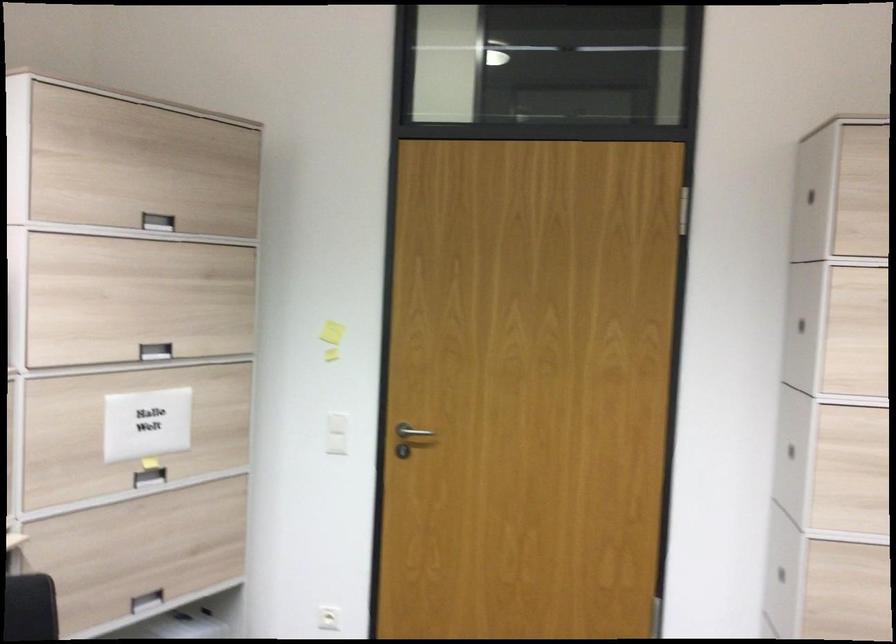
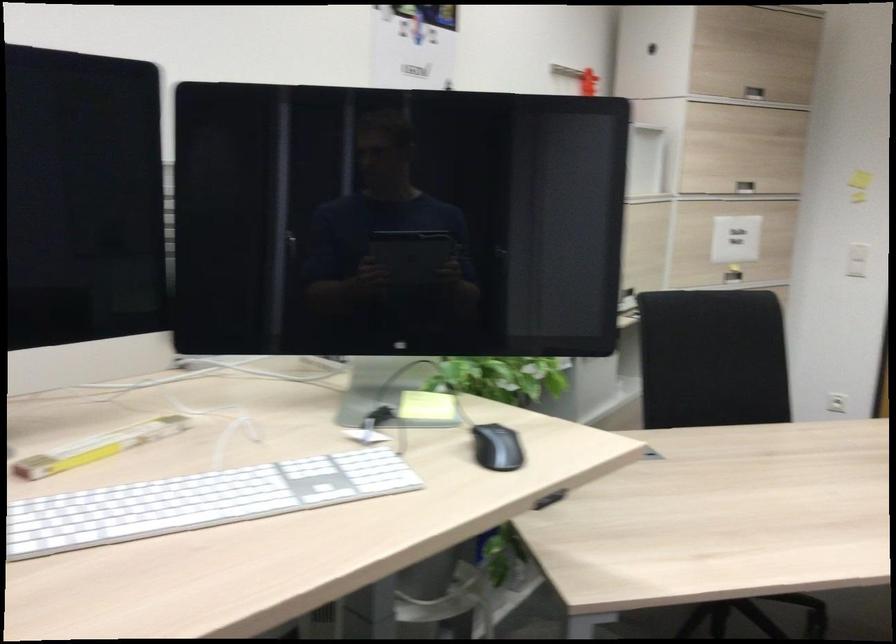
In the second image, find the point that corresponds to pixel 128 427 in the first image.

(736, 239)